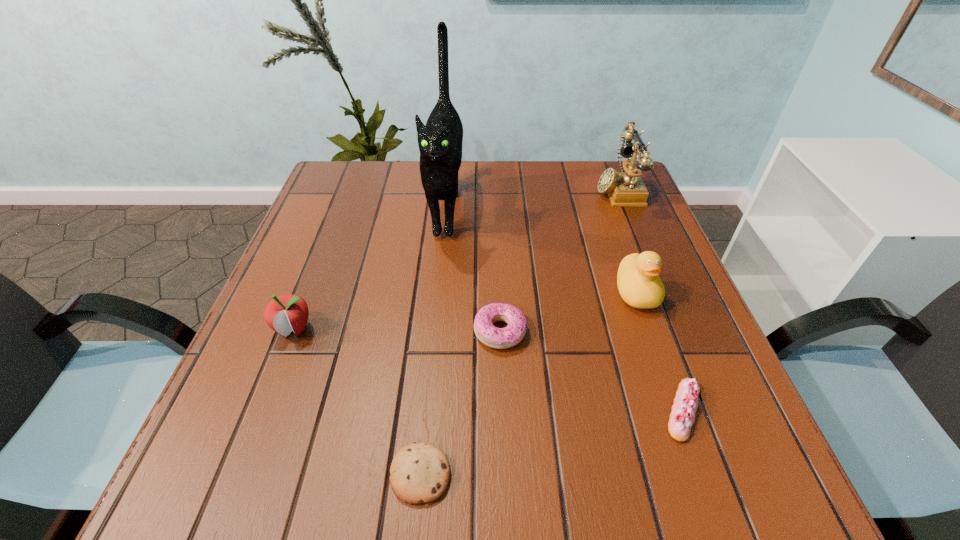
The width and height of the screenshot is (960, 540). I want to click on cat positioned at the far edge, so click(440, 142).

Identify the location of telephone at the far edge. This screenshot has height=540, width=960. (625, 189).

The width and height of the screenshot is (960, 540). In order to click on object located in the near edge section of the desktop in this screenshot , I will do `click(419, 473)`.

Locate an element on the screen. object situated at the left edge is located at coordinates (286, 313).

The width and height of the screenshot is (960, 540). I want to click on telephone present at the right edge, so click(x=625, y=189).

Locate an element on the screen. duck at the right edge is located at coordinates (639, 285).

Locate an element on the screen. This screenshot has height=540, width=960. eclair that is at the right edge is located at coordinates (682, 417).

Locate an element on the screen. object at the far right corner is located at coordinates (625, 189).

Find the location of a particular element. This screenshot has height=540, width=960. vacant space at the far edge is located at coordinates (516, 194).

Where is `vacant space at the near edge of the desktop`? The image size is (960, 540). vacant space at the near edge of the desktop is located at coordinates (627, 472).